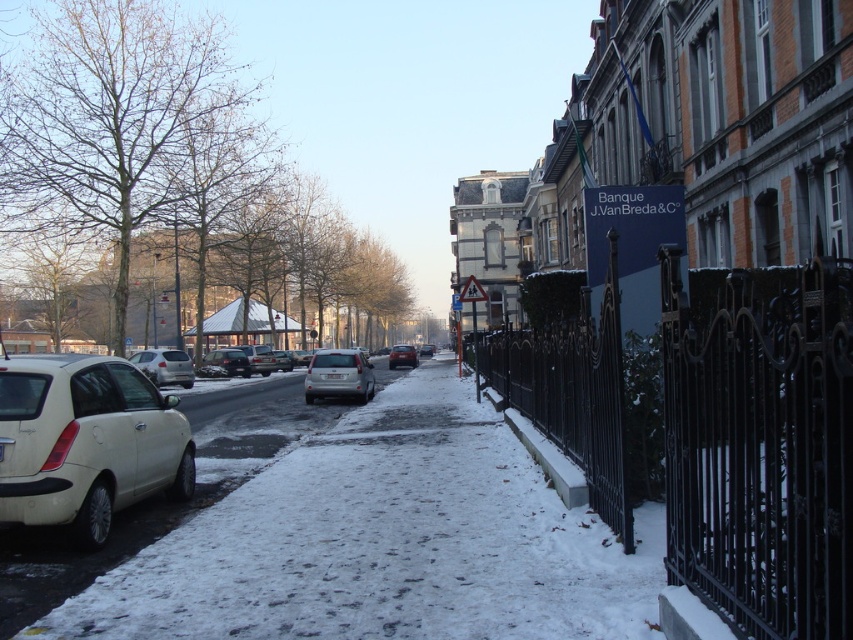
Question: Observing the image, what is the correct spatial positioning of satin silver sedan at center-left in reference to matte silver sedan at center?

Choices:
 (A) above
 (B) below

Answer: (A)

Question: Can you confirm if white snow at lower center is thinner than metallic silver car at center?

Choices:
 (A) no
 (B) yes

Answer: (A)

Question: Which is nearer to the white snow at lower center?

Choices:
 (A) matte white hatchback at left
 (B) satin silver sedan at center-left

Answer: (A)

Question: Can you confirm if matte white hatchback at left is positioned to the right of metallic silver car at center?

Choices:
 (A) no
 (B) yes

Answer: (B)

Question: Which object appears closest to the camera in this image?

Choices:
 (A) shiny red sedan at center
 (B) satin silver sedan at center-left

Answer: (B)

Question: Which is farther from the shiny red sedan at center?

Choices:
 (A) matte white hatchback at left
 (B) satin silver sedan at center
 (C) white snow at lower center
 (D) satin silver sedan at center-left

Answer: (A)